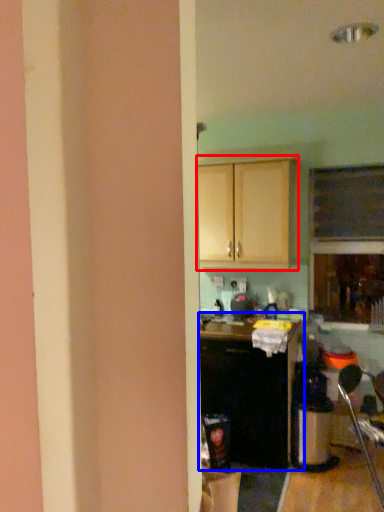
Question: Which of the following is the farthest to the observer, cabinetry (highlighted by a red box) or cabinetry (highlighted by a blue box)?

Choices:
 (A) cabinetry
 (B) cabinetry

Answer: (A)